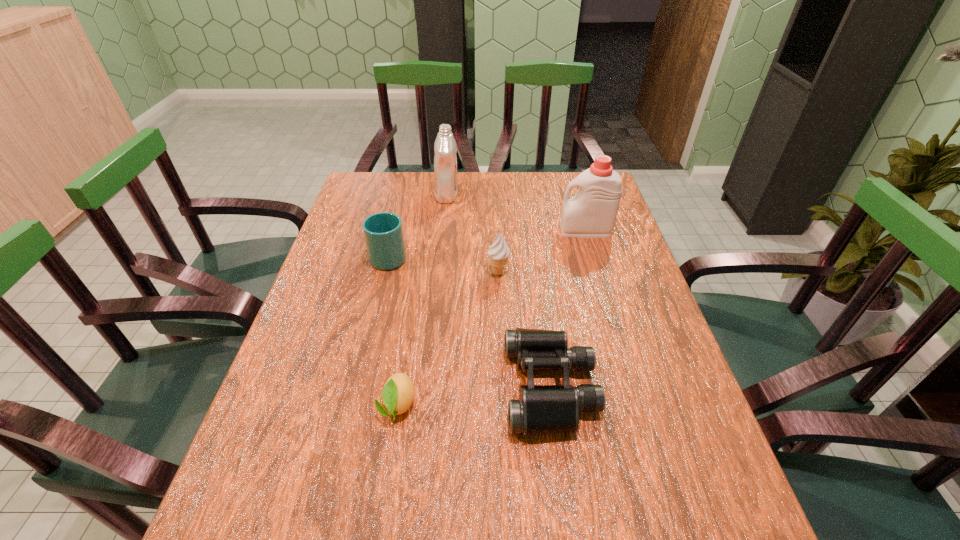
The width and height of the screenshot is (960, 540). In order to click on vacant space located on the handle side of the right detergent in this screenshot , I will do `click(493, 231)`.

This screenshot has height=540, width=960. Find the location of `vacant area located on the handle side of the right detergent`. vacant area located on the handle side of the right detergent is located at coordinates (516, 231).

Identify the location of free space located 0.230m on the front-facing side of the icecream. click(x=402, y=273).

The image size is (960, 540). I want to click on free location located 0.220m on the front-facing side of the icecream, so click(x=406, y=273).

Identify the location of vacant space located on the front-facing side of the icecream. This screenshot has height=540, width=960. (384, 273).

Where is `free space located on the handle side of the leftmost object`? free space located on the handle side of the leftmost object is located at coordinates (404, 195).

The image size is (960, 540). I want to click on blank space located on the handle side of the leftmost object, so click(398, 217).

Find the location of a particular element. free space located 0.100m on the handle side of the leftmost object is located at coordinates (397, 222).

Locate an element on the screen. This screenshot has height=540, width=960. vacant space located 0.240m on the front-facing side of the fifth tallest object is located at coordinates (393, 387).

Locate an element on the screen. This screenshot has width=960, height=540. free space located on the front-facing side of the fifth tallest object is located at coordinates (478, 387).